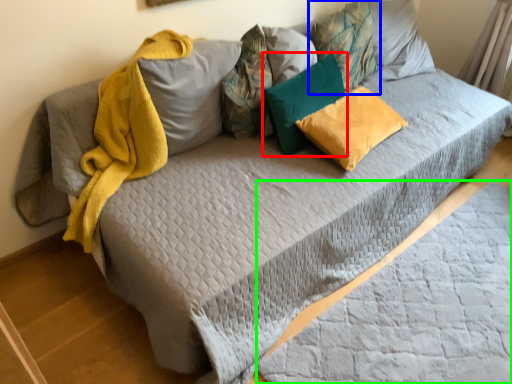
Question: Based on their relative distances, which object is farther from pillow (highlighted by a red box)? Choose from pillow (highlighted by a blue box) and sheet (highlighted by a green box).

Choices:
 (A) pillow
 (B) sheet

Answer: (B)